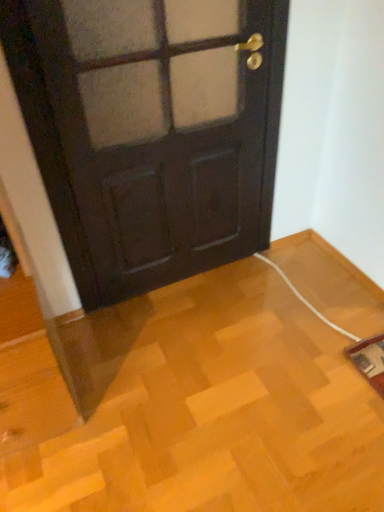
Describe the element at coordinates (161, 135) in the screenshot. I see `matte dark wood door at center` at that location.

Find the location of `matte dark wood door at center`. matte dark wood door at center is located at coordinates (161, 135).

This screenshot has height=512, width=384. I want to click on matte dark wood door at center, so click(x=161, y=135).